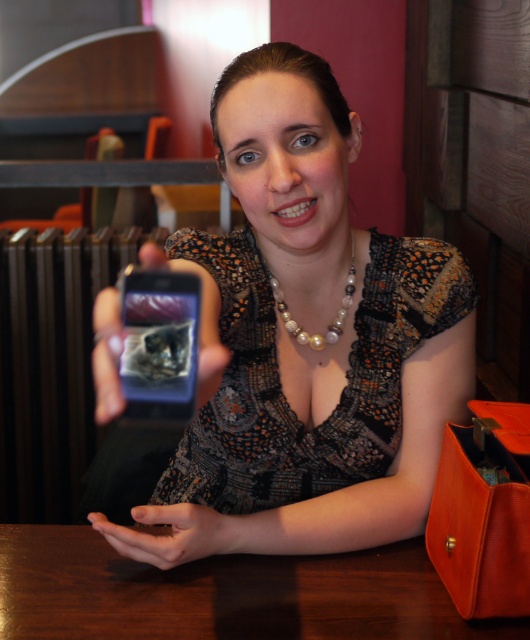
Question: Which of these objects is positioned closest to the satin black phone at center?

Choices:
 (A) pearl/shell necklace at center
 (B) smooth skin hand at lower center

Answer: (A)

Question: Considering the real-world distances, which object is closest to the satin black phone at center?

Choices:
 (A) smooth skin hand at lower center
 (B) matte black phone at center
 (C) brown wooden table at lower center

Answer: (B)

Question: Which object is the closest to the satin black phone at center?

Choices:
 (A) smooth skin hand at lower center
 (B) pearl/shell necklace at center
 (C) printed fabric dress at center
 (D) matte black phone at center

Answer: (D)

Question: Is matte black phone at center above printed fabric dress at center?

Choices:
 (A) no
 (B) yes

Answer: (B)

Question: Can you confirm if matte black phone at center is bigger than satin black phone at center?

Choices:
 (A) yes
 (B) no

Answer: (A)

Question: Considering the relative positions of matte black phone at center and brown wooden table at lower center in the image provided, where is matte black phone at center located with respect to brown wooden table at lower center?

Choices:
 (A) below
 (B) above

Answer: (B)